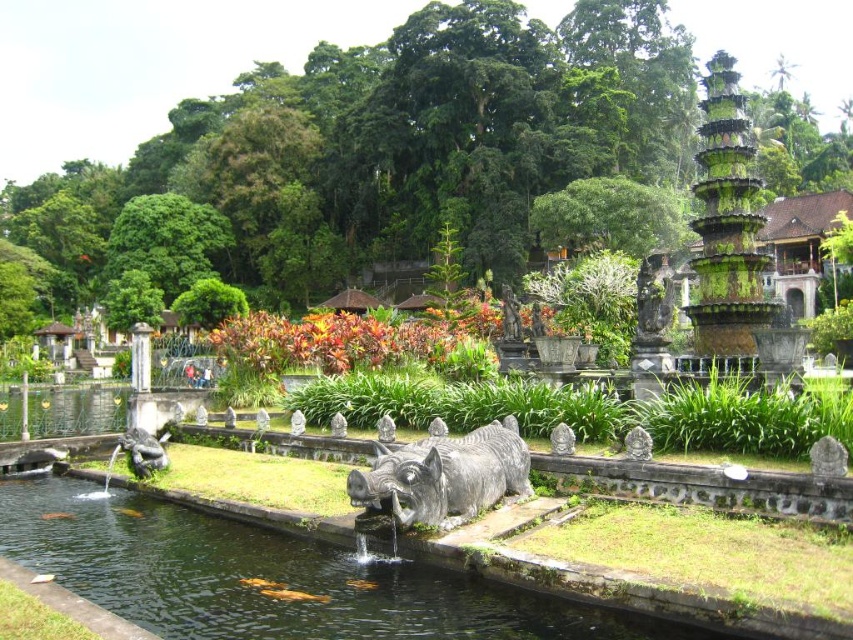
Question: Which point is farther to the camera?

Choices:
 (A) gray stone statue at center
 (B) smooth stone pond at center

Answer: (A)

Question: Is smooth stone pond at center to the left of gray stone statue at center from the viewer's perspective?

Choices:
 (A) no
 (B) yes

Answer: (B)

Question: Is smooth stone pond at center wider than gray stone statue at center?

Choices:
 (A) no
 (B) yes

Answer: (B)

Question: Which of the following is the closest to the observer?

Choices:
 (A) smooth stone pond at center
 (B) gray stone statue at center

Answer: (A)

Question: Among these objects, which one is nearest to the camera?

Choices:
 (A) gray stone statue at center
 (B) smooth stone pond at center

Answer: (B)

Question: Does smooth stone pond at center have a larger size compared to gray stone statue at center?

Choices:
 (A) yes
 (B) no

Answer: (A)